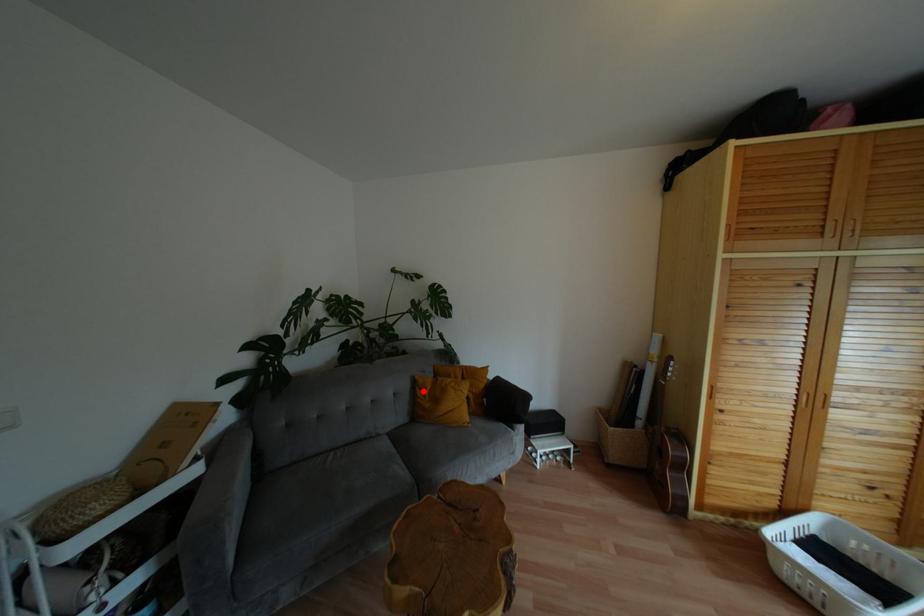
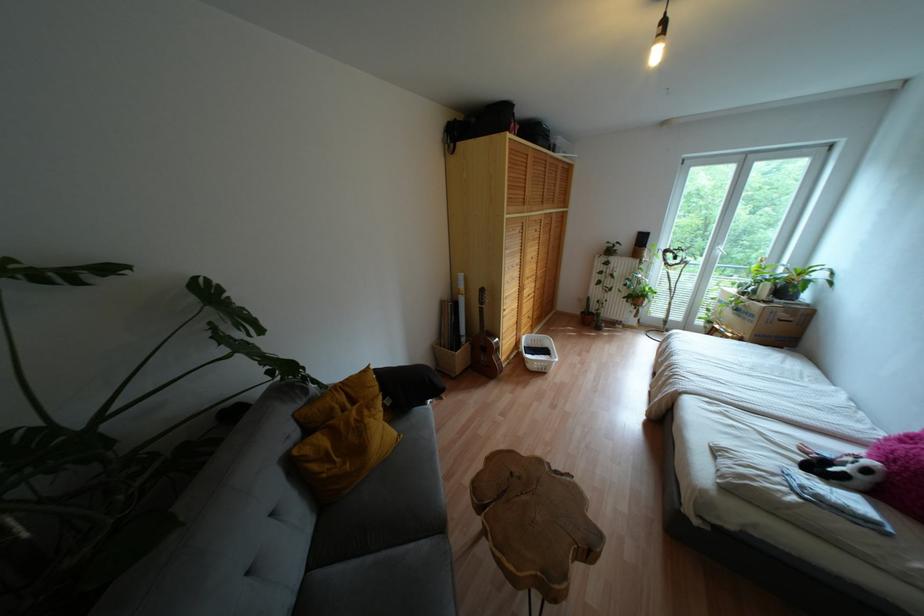
In the second image, find the point that corresponds to the highlighted location in the first image.

(325, 458)